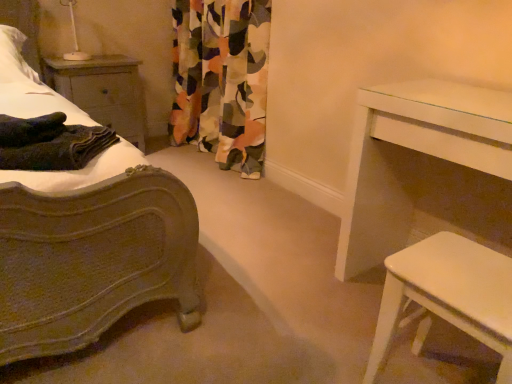
Image resolution: width=512 pixels, height=384 pixels. Describe the element at coordinates (424, 167) in the screenshot. I see `white glossy table at right, the 2th table positioned from the front` at that location.

What do you see at coordinates (103, 91) in the screenshot? The height and width of the screenshot is (384, 512). I see `wooden nightstand at left` at bounding box center [103, 91].

Where is `dark green textured blanket at left`? Image resolution: width=512 pixels, height=384 pixels. dark green textured blanket at left is located at coordinates (50, 143).

What are the coordinates of `white glossy table at right, the 2th table positioned from the front` in the screenshot? It's located at (424, 167).

Considering the positions of point (13, 131) and point (396, 229), is point (13, 131) closer or farther from the camera than point (396, 229)?

Point (13, 131) is closer to the camera than point (396, 229).

Based on their positions, is dark green textured blanket at left located to the left or right of white glossy table at right, the 2th table positioned from the front?

dark green textured blanket at left is to the left of white glossy table at right, the 2th table positioned from the front.

From the image's perspective, is dark green textured blanket at left above or below white glossy table at right, which is the first table from back to front?

Based on their image positions, dark green textured blanket at left is located above white glossy table at right, which is the first table from back to front.

There is a dark green textured blanket at left. Where is `the 1st table below it (from the image's perspective)`? the 1st table below it (from the image's perspective) is located at coordinates pyautogui.click(x=424, y=167).

Is dark green textured blanket at left at the back of white glossy table at right, the 2th table positioned from the front?

white glossy table at right, the 2th table positioned from the front, is not turned away from dark green textured blanket at left.

From the picture: Which is less distant, (409, 232) or (32, 163)?

Point (409, 232) appears to be farther away from the viewer than point (32, 163).

Considering the positions of objects white glossy table at right, which is the first table from back to front, and dark green textured blanket at left in the image provided, who is in front, white glossy table at right, which is the first table from back to front, or dark green textured blanket at left?

Positioned in front is white glossy table at right, which is the first table from back to front.

What's the angular difference between white glossy table at right, the 2th table positioned from the front, and dark green textured blanket at left's facing directions?

51.7 degrees.

Considering the sizes of objects white soft pillow at upper left and multicolored fabric curtain at center in the image provided, who is bigger, white soft pillow at upper left or multicolored fabric curtain at center?

multicolored fabric curtain at center.

The height and width of the screenshot is (384, 512). Identify the location of pillow below the multicolored fabric curtain at center (from the image's perspective). (14, 57).

Could you tell me if white soft pillow at upper left is turned towards multicolored fabric curtain at center?

No, white soft pillow at upper left is not aimed at multicolored fabric curtain at center.

Based on the photo, is white soft pillow at upper left to the right of multicolored fabric curtain at center from the viewer's perspective?

In fact, white soft pillow at upper left is to the left of multicolored fabric curtain at center.

Can you confirm if white glossy stool at lower right, which appears as the 1th table when viewed from the front, is positioned to the right of white soft pillow at upper left?

Yes, white glossy stool at lower right, which appears as the 1th table when viewed from the front, is to the right of white soft pillow at upper left.

Is white soft pillow at upper left inside white glossy stool at lower right, the 2th table viewed from the back?

No, white soft pillow at upper left is not surrounded by white glossy stool at lower right, the 2th table viewed from the back.

Considering the positions of objects white glossy stool at lower right, the 2th table viewed from the back, and white soft pillow at upper left in the image provided, who is in front, white glossy stool at lower right, the 2th table viewed from the back, or white soft pillow at upper left?

white glossy stool at lower right, the 2th table viewed from the back, is closer to the camera.

Is white glossy stool at lower right, the 2th table viewed from the back, taller or shorter than white soft pillow at upper left?

In the image, white glossy stool at lower right, the 2th table viewed from the back, appears to be taller than white soft pillow at upper left.

Does wooden nightstand at left have a lesser height compared to white soft pillow at upper left?

Incorrect, the height of wooden nightstand at left does not fall short of that of white soft pillow at upper left.

Which object is closer to the camera, wooden nightstand at left or white soft pillow at upper left?

Positioned in front is white soft pillow at upper left.

The height and width of the screenshot is (384, 512). In the image, there is a white soft pillow at upper left. Identify the location of nightstand below it (from the image's perspective). (103, 91).

Does wooden nightstand at left contain white soft pillow at upper left?

No, wooden nightstand at left does not contain white soft pillow at upper left.

From a real-world perspective, relative to white glossy stool at lower right, which appears as the 1th table when viewed from the front, is wooden nightstand at left vertically above or below?

Clearly, from a real-world perspective, wooden nightstand at left is above white glossy stool at lower right, which appears as the 1th table when viewed from the front.

In the scene shown: Who is taller, wooden nightstand at left or white glossy stool at lower right, the 2th table viewed from the back?

Result: With more height is wooden nightstand at left.

From the picture: Would you consider wooden nightstand at left to be distant from white glossy stool at lower right, which appears as the 1th table when viewed from the front?

Absolutely, wooden nightstand at left is distant from white glossy stool at lower right, which appears as the 1th table when viewed from the front.

This screenshot has width=512, height=384. I want to click on curtain lying on the left of white glossy stool at lower right, the 2th table viewed from the back, so click(x=222, y=80).

Is multicolored fabric curtain at center positioned with its back to white glossy stool at lower right, the 2th table viewed from the back?

That's not correct — multicolored fabric curtain at center is not looking away from white glossy stool at lower right, the 2th table viewed from the back.

From the picture: From a real-world perspective, is multicolored fabric curtain at center positioned above or below white glossy stool at lower right, the 2th table viewed from the back?

In terms of real-world spatial position, multicolored fabric curtain at center is above white glossy stool at lower right, the 2th table viewed from the back.

Considering the relative sizes of multicolored fabric curtain at center and white glossy stool at lower right, the 2th table viewed from the back, in the image provided, is multicolored fabric curtain at center shorter than white glossy stool at lower right, the 2th table viewed from the back,?

No, multicolored fabric curtain at center is not shorter than white glossy stool at lower right, the 2th table viewed from the back.

At what (x,y) coordinates should I click in order to perform the action: click on blanket on the left of white glossy table at right, the 2th table positioned from the front. Please return your answer as a coordinate pair (x, y). Looking at the image, I should click on (50, 143).

Find the location of a particular element. blanket above the white glossy table at right, the 2th table positioned from the front (from the image's perspective) is located at coordinates (50, 143).

Looking at the image, which one is located further to white glossy table at right, which is the first table from back to front, dark green textured blanket at left or multicolored fabric curtain at center?

Based on the image, multicolored fabric curtain at center appears to be further to white glossy table at right, which is the first table from back to front.

Consider the image. Which object lies further to the anchor point dark green textured blanket at left, wooden nightstand at left or multicolored fabric curtain at center?

Among the two, multicolored fabric curtain at center is located further to dark green textured blanket at left.

Looking at the image, which one is located further to white glossy table at right, which is the first table from back to front, white glossy stool at lower right, which appears as the 1th table when viewed from the front, or dark green textured blanket at left?

dark green textured blanket at left is further to white glossy table at right, which is the first table from back to front.

Which object lies further to the anchor point multicolored fabric curtain at center, dark green textured blanket at left or wooden nightstand at left?

The object further to multicolored fabric curtain at center is dark green textured blanket at left.

Looking at the image, which one is located closer to white soft pillow at upper left, dark green textured blanket at left or white glossy stool at lower right, the 2th table viewed from the back?

dark green textured blanket at left is positioned closer to the anchor white soft pillow at upper left.

When comparing their distances from wooden nightstand at left, does white glossy stool at lower right, the 2th table viewed from the back, or multicolored fabric curtain at center seem further?

Among the two, white glossy stool at lower right, the 2th table viewed from the back, is located further to wooden nightstand at left.

Considering their positions, is dark green textured blanket at left positioned further to white glossy stool at lower right, which appears as the 1th table when viewed from the front, than white soft pillow at upper left?

Among the two, white soft pillow at upper left is located further to white glossy stool at lower right, which appears as the 1th table when viewed from the front.

When comparing their distances from white glossy stool at lower right, which appears as the 1th table when viewed from the front, does white glossy table at right, the 2th table positioned from the front, or dark green textured blanket at left seem further?

The object further to white glossy stool at lower right, which appears as the 1th table when viewed from the front, is dark green textured blanket at left.

At what (x,y) coordinates should I click in order to perform the action: click on blanket between white soft pillow at upper left and white glossy stool at lower right, which appears as the 1th table when viewed from the front, in the horizontal direction. Please return your answer as a coordinate pair (x, y). The width and height of the screenshot is (512, 384). Looking at the image, I should click on (50, 143).

Find the location of a particular element. blanket between white glossy stool at lower right, the 2th table viewed from the back, and multicolored fabric curtain at center from front to back is located at coordinates (50, 143).

What are the coordinates of `table between wooden nightstand at left and white glossy table at right, the 2th table positioned from the front, from left to right` in the screenshot? It's located at (449, 294).

The image size is (512, 384). I want to click on curtain between dark green textured blanket at left and white glossy table at right, the 2th table positioned from the front, from left to right, so click(222, 80).